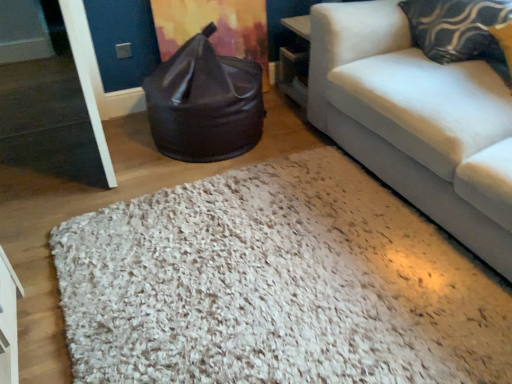
At what (x,y) coordinates should I click in order to perform the action: click on patterned fabric pillow at upper right. Please return your answer as a coordinate pair (x, y). This screenshot has height=384, width=512. Looking at the image, I should click on (459, 30).

Considering the relative sizes of black leather bean bag at center and white shaggy rug at center in the image provided, is black leather bean bag at center smaller than white shaggy rug at center?

No, black leather bean bag at center is not smaller than white shaggy rug at center.

In terms of height, does black leather bean bag at center look taller or shorter compared to white shaggy rug at center?

Clearly, black leather bean bag at center is taller compared to white shaggy rug at center.

Where is `bean bag chair located behind the white shaggy rug at center`? This screenshot has height=384, width=512. bean bag chair located behind the white shaggy rug at center is located at coordinates (205, 103).

Considering the relative sizes of black leather bean bag at center and white shaggy rug at center in the image provided, is black leather bean bag at center wider than white shaggy rug at center?

No, black leather bean bag at center is not wider than white shaggy rug at center.

How distant is patterned fabric pillow at upper right from black leather bean bag at center?

patterned fabric pillow at upper right and black leather bean bag at center are 1.08 meters apart.

Which of these two, patterned fabric pillow at upper right or black leather bean bag at center, is bigger?

With larger size is black leather bean bag at center.

From the image's perspective, is patterned fabric pillow at upper right located beneath black leather bean bag at center?

Incorrect, from the image's perspective, patterned fabric pillow at upper right is higher than black leather bean bag at center.

Is patterned fabric pillow at upper right facing away from black leather bean bag at center?

No, black leather bean bag at center is not at the back of patterned fabric pillow at upper right.

Can you confirm if black leather bean bag at center is bigger than patterned fabric pillow at upper right?

Yes, black leather bean bag at center is bigger than patterned fabric pillow at upper right.

How different are the orientations of black leather bean bag at center and patterned fabric pillow at upper right in degrees?

The facing directions of black leather bean bag at center and patterned fabric pillow at upper right are 72.7 degrees apart.

Considering the positions of objects black leather bean bag at center and patterned fabric pillow at upper right in the image provided, who is more to the left, black leather bean bag at center or patterned fabric pillow at upper right?

Positioned to the left is black leather bean bag at center.

Does white shaggy rug at center have a greater width compared to patterned fabric pillow at upper right?

Answer: Yes, white shaggy rug at center is wider than patterned fabric pillow at upper right.

You are a GUI agent. You are given a task and a screenshot of the screen. Output one action in this format:
    pyautogui.click(x=<x>, y=<y>)
    Task: Click on the pillow on the right of white shaggy rug at center
    This screenshot has width=512, height=384.
    Given the screenshot: What is the action you would take?
    pyautogui.click(x=459, y=30)

Is white shaggy rug at center looking in the opposite direction of patterned fabric pillow at upper right?

No, patterned fabric pillow at upper right is not at the back of white shaggy rug at center.

Based on their positions, is white shaggy rug at center located to the left or right of patterned fabric pillow at upper right?

Clearly, white shaggy rug at center is on the left of patterned fabric pillow at upper right in the image.

From the image's perspective, which is below, patterned fabric pillow at upper right or white shaggy rug at center?

white shaggy rug at center.

Between patterned fabric pillow at upper right and white shaggy rug at center, which one appears on the left side from the viewer's perspective?

white shaggy rug at center.

Does patterned fabric pillow at upper right have a greater width compared to white shaggy rug at center?

Incorrect, the width of patterned fabric pillow at upper right does not surpass that of white shaggy rug at center.

In the scene shown: Considering the sizes of objects patterned fabric pillow at upper right and white shaggy rug at center in the image provided, who is bigger, patterned fabric pillow at upper right or white shaggy rug at center?

white shaggy rug at center is bigger.

Which is less distant, (507, 297) or (262, 102)?

Point (507, 297) appears to be closer to the viewer than point (262, 102).

Are white shaggy rug at center and black leather bean bag at center located far from each other?

white shaggy rug at center is near black leather bean bag at center, not far away.

From a real-world perspective, who is located higher, white shaggy rug at center or black leather bean bag at center?

black leather bean bag at center is physically above.

Locate an element on the screen. The width and height of the screenshot is (512, 384). bean bag chair that is on the left side of white shaggy rug at center is located at coordinates (205, 103).

Where is `bean bag chair behind the patterned fabric pillow at upper right`? Image resolution: width=512 pixels, height=384 pixels. bean bag chair behind the patterned fabric pillow at upper right is located at coordinates (205, 103).

From the image, which object appears to be farther from patterned fabric pillow at upper right, white shaggy rug at center or black leather bean bag at center?

white shaggy rug at center is positioned further to the anchor patterned fabric pillow at upper right.

Estimate the real-world distances between objects in this image. Which object is further from patterned fabric pillow at upper right, black leather bean bag at center or white shaggy rug at center?

Based on the image, white shaggy rug at center appears to be further to patterned fabric pillow at upper right.

Which object lies nearer to the anchor point black leather bean bag at center, patterned fabric pillow at upper right or white shaggy rug at center?

white shaggy rug at center.

Estimate the real-world distances between objects in this image. Which object is closer to white shaggy rug at center, black leather bean bag at center or patterned fabric pillow at upper right?

Among the two, black leather bean bag at center is located nearer to white shaggy rug at center.

Considering their positions, is patterned fabric pillow at upper right positioned further to white shaggy rug at center than black leather bean bag at center?

Among the two, patterned fabric pillow at upper right is located further to white shaggy rug at center.

When comparing their distances from black leather bean bag at center, does white shaggy rug at center or patterned fabric pillow at upper right seem closer?

white shaggy rug at center lies closer to black leather bean bag at center than the other object.

The height and width of the screenshot is (384, 512). I want to click on mat between black leather bean bag at center and patterned fabric pillow at upper right, so click(276, 285).